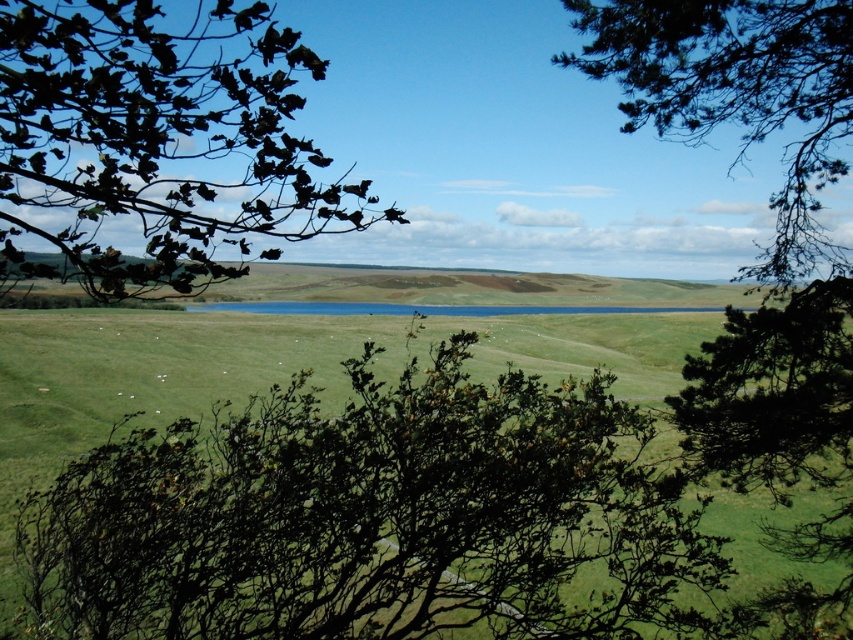
Question: Is green leafy tree at center smaller than green leafy branches at upper left?

Choices:
 (A) no
 (B) yes

Answer: (B)

Question: Which is nearer to the green leafy tree at center?

Choices:
 (A) green needle-like branches at upper right
 (B) green leafy branches at upper left

Answer: (B)

Question: Which point is farther to the camera?

Choices:
 (A) (704, 65)
 (B) (372, 508)
 (C) (16, 170)

Answer: (A)

Question: Is the position of green leafy tree at center more distant than that of green needle-like branches at upper right?

Choices:
 (A) no
 (B) yes

Answer: (A)

Question: Based on their relative distances, which object is farther from the green needle-like branches at upper right?

Choices:
 (A) green leafy branches at upper left
 (B) green leafy tree at center

Answer: (B)

Question: In this image, where is green leafy tree at center located relative to green needle-like branches at upper right?

Choices:
 (A) left
 (B) right

Answer: (A)